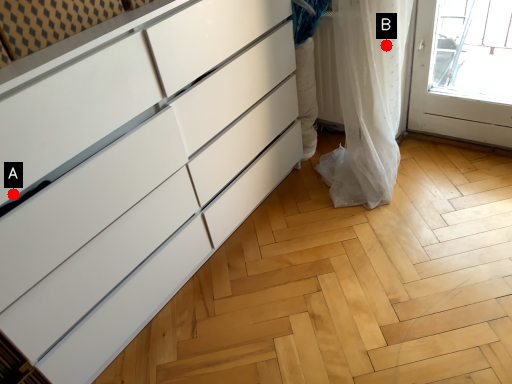
Question: Two points are circled on the image, labeled by A and B beside each circle. Which point appears closest to the camera in this image?

Choices:
 (A) A is closer
 (B) B is closer

Answer: (A)